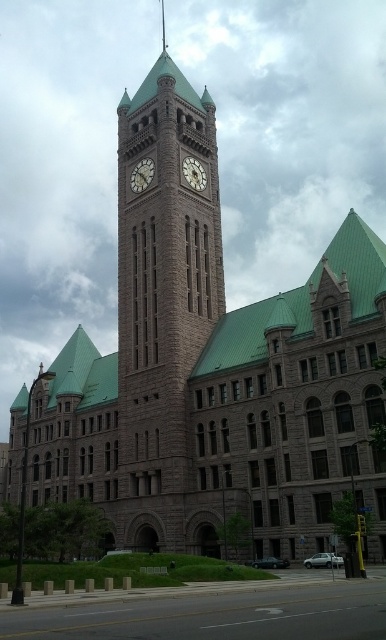
Can you confirm if brown stone clock tower at center is smaller than matte brown clock at center?

No, brown stone clock tower at center is not smaller than matte brown clock at center.

Where is `brown stone clock tower at center`? Image resolution: width=386 pixels, height=640 pixels. brown stone clock tower at center is located at coordinates [x=164, y=308].

Does matte brown clock at center have a greater width compared to gold-toned metal clock at upper center?

Correct, the width of matte brown clock at center exceeds that of gold-toned metal clock at upper center.

Describe the element at coordinates (142, 173) in the screenshot. I see `matte brown clock at center` at that location.

Locate an element on the screen. The image size is (386, 640). matte brown clock at center is located at coordinates (142, 173).

Identify the location of matte brown clock at center. [142, 173].

Is brown stone clock tower at center thinner than gold-toned metal clock at upper center?

Incorrect, brown stone clock tower at center's width is not less than gold-toned metal clock at upper center's.

Does brown stone clock tower at center lie in front of gold-toned metal clock at upper center?

Yes.

Is point (184, 509) behind point (198, 164)?

No, it is in front of (198, 164).

Find the location of a particular element. The image size is (386, 640). brown stone clock tower at center is located at coordinates (164, 308).